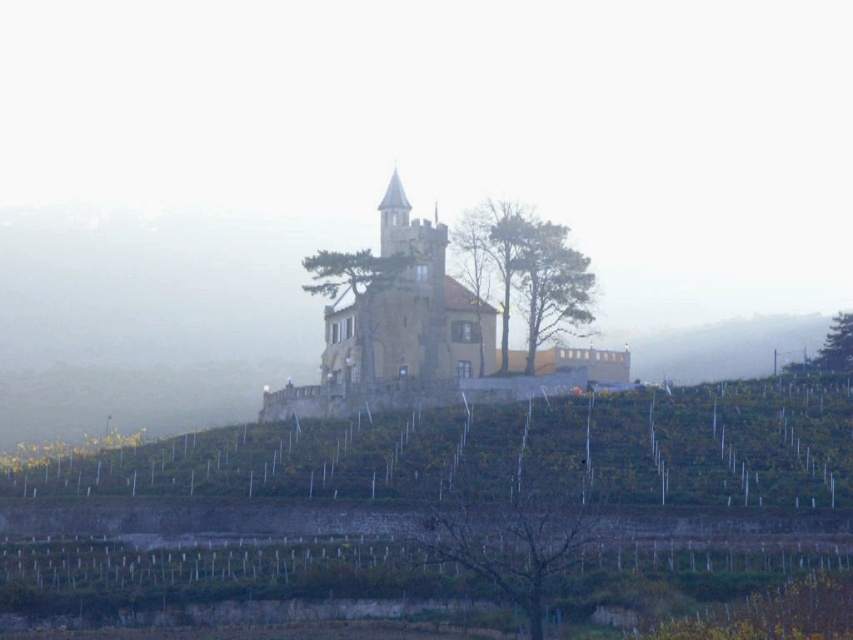
Question: Which object appears closest to the camera in this image?

Choices:
 (A) yellow stone church at center
 (B) brown textured tree at center

Answer: (B)

Question: Is yellow stone church at center bigger than brown textured tree at center?

Choices:
 (A) yes
 (B) no

Answer: (A)

Question: Can you confirm if brown textured tree at center is positioned below green leafy tree at upper right?

Choices:
 (A) no
 (B) yes

Answer: (B)

Question: Which object is the farthest from the green matte tree at center?

Choices:
 (A) green textured tree at center
 (B) brown textured tree at center

Answer: (B)

Question: Among these objects, which one is nearest to the camera?

Choices:
 (A) brown textured tree at center
 (B) green matte tree at center
 (C) green leafy tree at upper right
 (D) green textured tree at center

Answer: (A)

Question: Does green matte tree at center appear on the left side of green leafy tree at upper right?

Choices:
 (A) no
 (B) yes

Answer: (B)